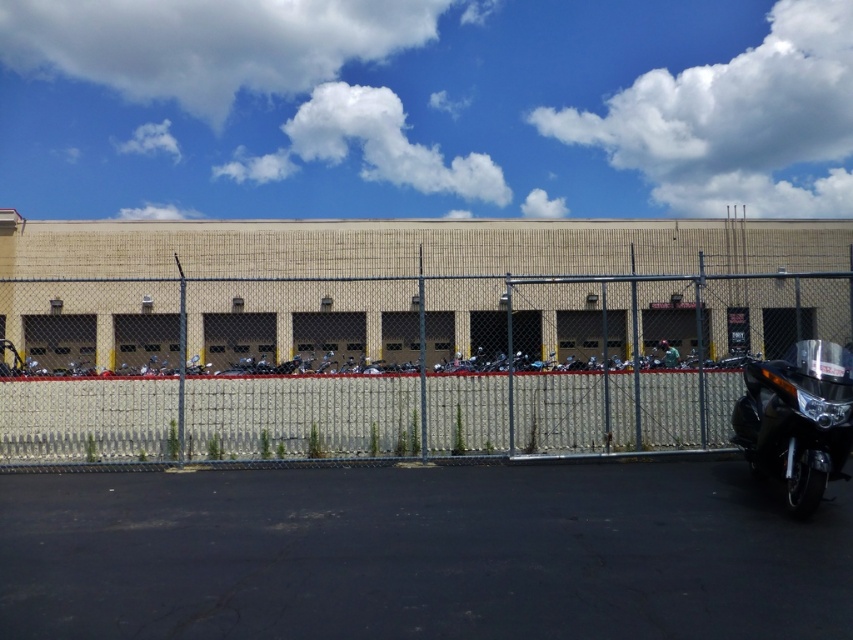
Question: Among these points, which one is farthest from the camera?

Choices:
 (A) (573, 436)
 (B) (590, 579)

Answer: (A)

Question: Which object is positioned farthest from the glossy black motorcycle at lower right?

Choices:
 (A) metallic chain-link fence at center
 (B) black asphalt at lower center

Answer: (B)

Question: Can you confirm if black asphalt at lower center is positioned to the right of metallic chain-link fence at center?

Choices:
 (A) yes
 (B) no

Answer: (B)

Question: Is black asphalt at lower center above metallic chain-link fence at center?

Choices:
 (A) no
 (B) yes

Answer: (A)

Question: Estimate the real-world distances between objects in this image. Which object is closer to the metallic chain-link fence at center?

Choices:
 (A) glossy black motorcycle at lower right
 (B) black asphalt at lower center

Answer: (A)

Question: Is the position of black asphalt at lower center more distant than that of glossy black motorcycle at lower right?

Choices:
 (A) yes
 (B) no

Answer: (B)